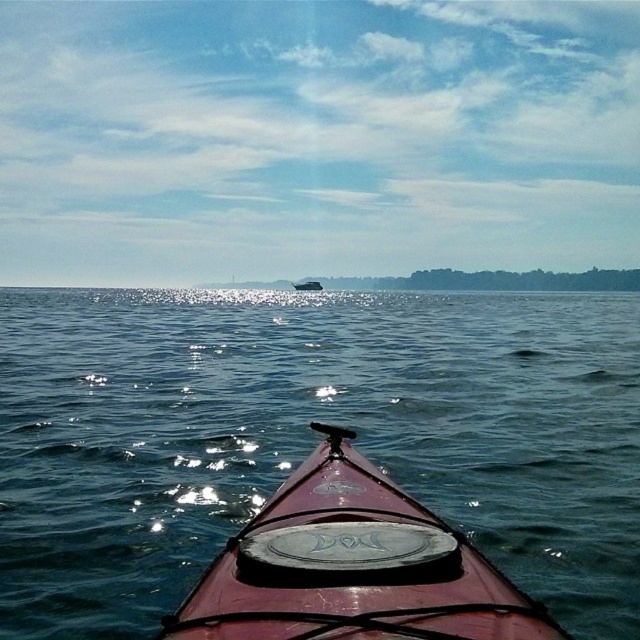
Question: From the image, what is the correct spatial relationship of shiny red kayak at center in relation to metallic silver boat at center?

Choices:
 (A) below
 (B) above

Answer: (A)

Question: Does glossy water at center have a lesser width compared to metallic silver boat at center?

Choices:
 (A) yes
 (B) no

Answer: (B)

Question: From the image, what is the correct spatial relationship of glossy water at center in relation to shiny red kayak at center?

Choices:
 (A) above
 (B) below

Answer: (A)

Question: Which of the following is the farthest from the observer?

Choices:
 (A) metallic silver boat at center
 (B) shiny red kayak at center

Answer: (A)

Question: Which of these objects is positioned closest to the shiny red kayak at center?

Choices:
 (A) glossy water at center
 (B) metallic silver boat at center

Answer: (A)

Question: Among these objects, which one is farthest from the camera?

Choices:
 (A) metallic silver boat at center
 (B) shiny red kayak at center

Answer: (A)